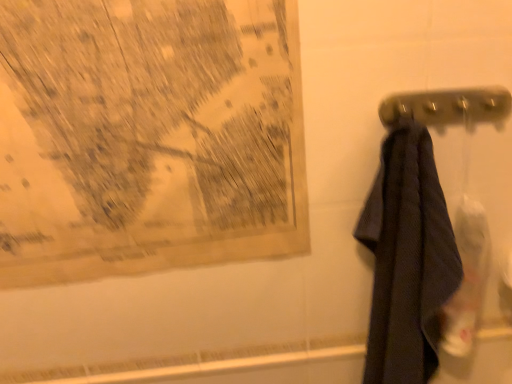
Question: Is black textured towel at right in front of or behind yellowed paper map at upper left in the image?

Choices:
 (A) front
 (B) behind

Answer: (A)

Question: In terms of size, does black textured towel at right appear bigger or smaller than yellowed paper map at upper left?

Choices:
 (A) big
 (B) small

Answer: (A)

Question: Considering the real-world distances, which object is farthest from the yellowed paper map at upper left?

Choices:
 (A) black textured towel at right
 (B) metallic gray towel bar at right

Answer: (B)

Question: Which object is positioned farthest from the black textured towel at right?

Choices:
 (A) metallic gray towel bar at right
 (B) yellowed paper map at upper left

Answer: (B)